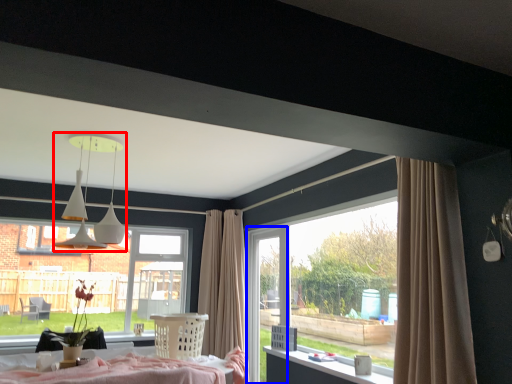
Question: Which point is closer to the camera, lamp (highlighted by a red box) or screen door (highlighted by a blue box)?

Choices:
 (A) lamp
 (B) screen door

Answer: (A)